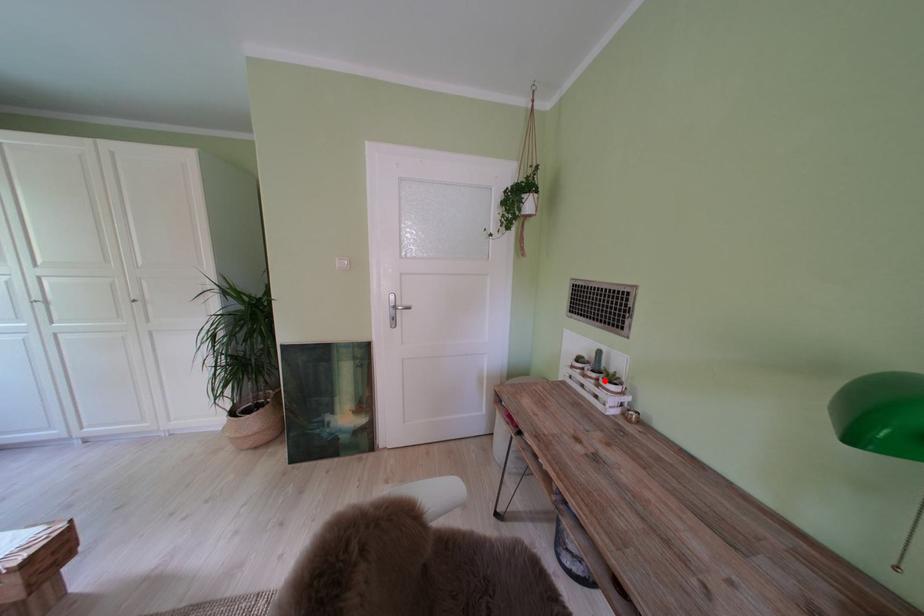
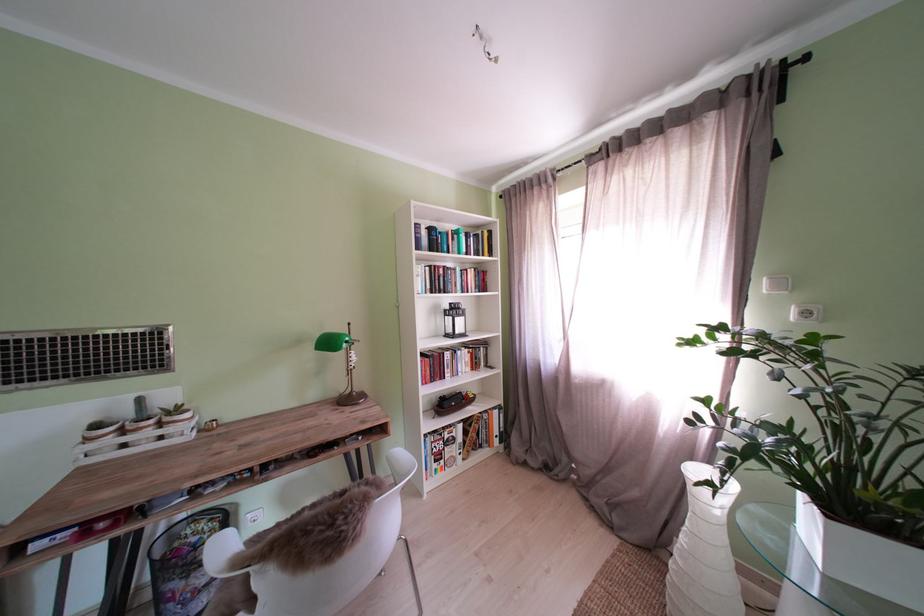
Question: I am providing you with two images of the same scene from different viewpoints. A red point is marked on the first image. Can you still see the location of the red point in image 2?

Choices:
 (A) Yes
 (B) No

Answer: (A)